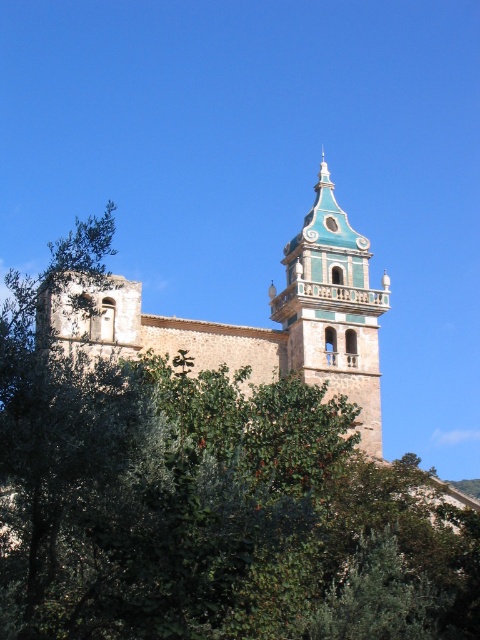
You are an architect visiting this historic site. You need to take a photo of the light brown stone church at center without any obstruction. Is the green leafy tree at center blocking your view of the church?

The green leafy tree at center is larger in size than the light brown stone church at center, so it is likely blocking the view of the church.